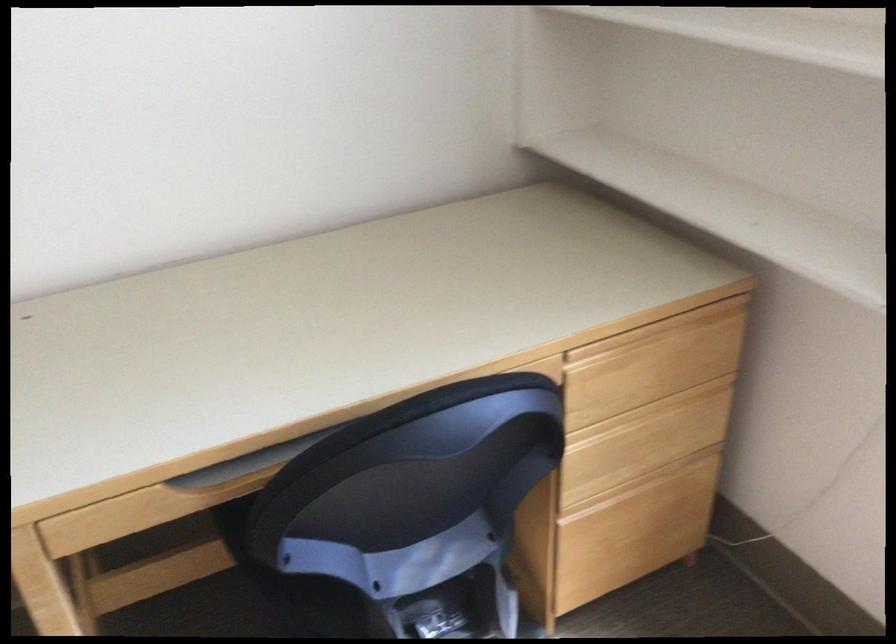
You are a GUI agent. You are given a task and a screenshot of the screen. Output one action in this format:
    pyautogui.click(x=<x>, y=<y>)
    Task: Click on the chair sitting surface
    The width and height of the screenshot is (896, 644).
    Given the screenshot: What is the action you would take?
    pyautogui.click(x=329, y=607)